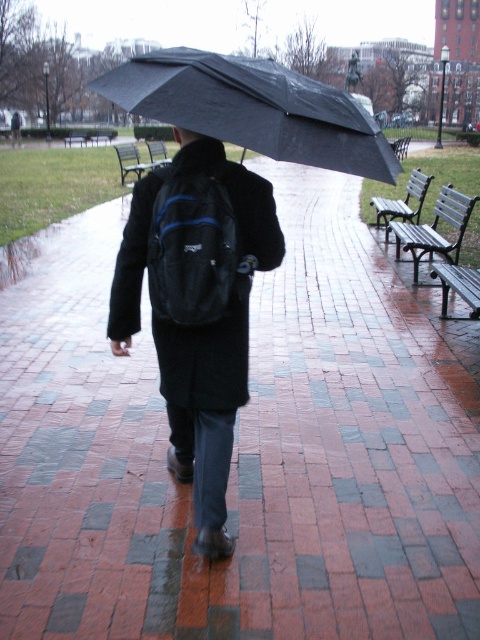
From the picture: How distant is metallic silver bench at left from wooden park bench at center?

A distance of 3.83 feet exists between metallic silver bench at left and wooden park bench at center.

Who is more forward, (122, 145) or (158, 145)?

Point (122, 145)

Identify the location of metallic silver bench at left. The image size is (480, 640). (133, 161).

The image size is (480, 640). What do you see at coordinates (196, 307) in the screenshot?
I see `matte black backpack at center` at bounding box center [196, 307].

Between point (169, 296) and point (456, 276), which one is positioned behind?

The point (456, 276) is more distant.

Does point (216, 241) lie in front of point (448, 275)?

That is True.

At what (x,y) coordinates should I click in order to perform the action: click on matte black backpack at center. Please return your answer as a coordinate pair (x, y). Looking at the image, I should click on (196, 307).

Does black matte umbrella at center have a lesser width compared to wooden bench at center?

Correct, black matte umbrella at center's width is less than wooden bench at center's.

In the scene shown: Who is more forward, (118, 102) or (406, 141)?

Point (118, 102)

Identify the location of black matte umbrella at center. The height and width of the screenshot is (640, 480). (252, 108).